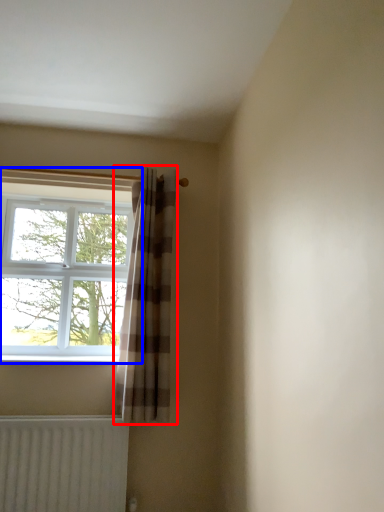
Question: Which object appears closest to the camera in this image, curtain (highlighted by a red box) or window (highlighted by a blue box)?

Choices:
 (A) curtain
 (B) window

Answer: (A)